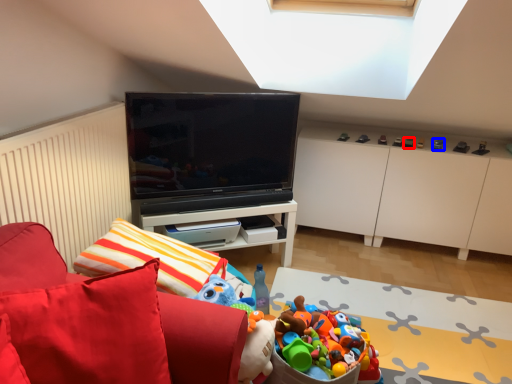
Question: Which point is further to the camera, toy (highlighted by a red box) or toy (highlighted by a blue box)?

Choices:
 (A) toy
 (B) toy

Answer: (A)